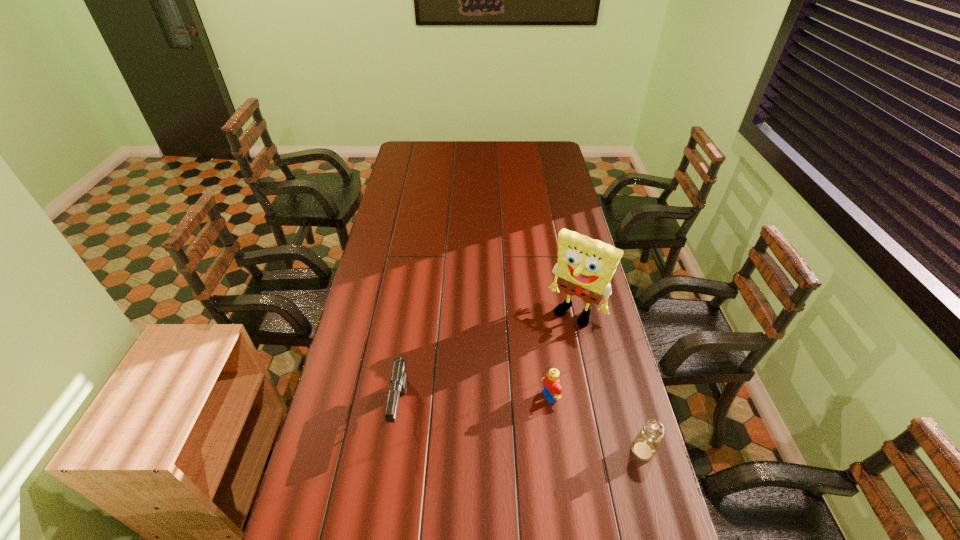
The height and width of the screenshot is (540, 960). Identify the location of free space on the desktop that is between the leftmost object and the saltshaker and is positioned on the face of the Lego. (491, 424).

I want to click on vacant space on the desktop that is between the leftmost object and the saltshaker and is positioned on the face of the sponge, so (x=496, y=426).